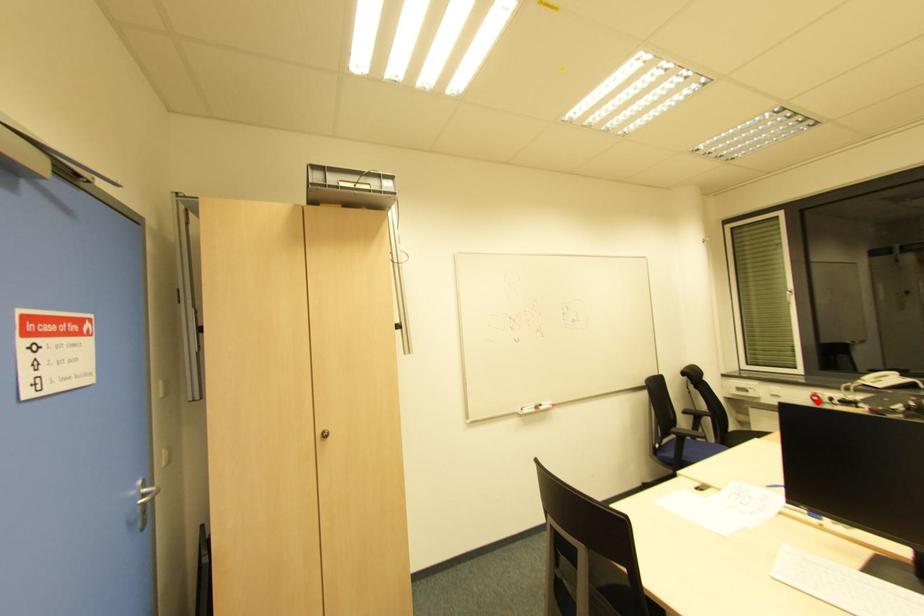
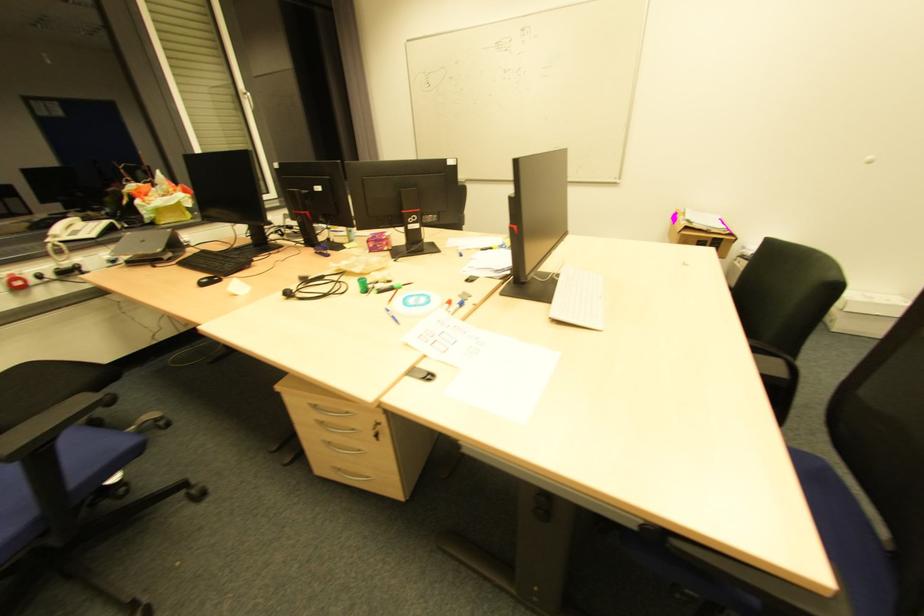
Question: I am providing you with two images of the same scene from different viewpoints. A red point is marked on the first image. Can you still see the location of the red point in image 2?

Choices:
 (A) Yes
 (B) No

Answer: (A)